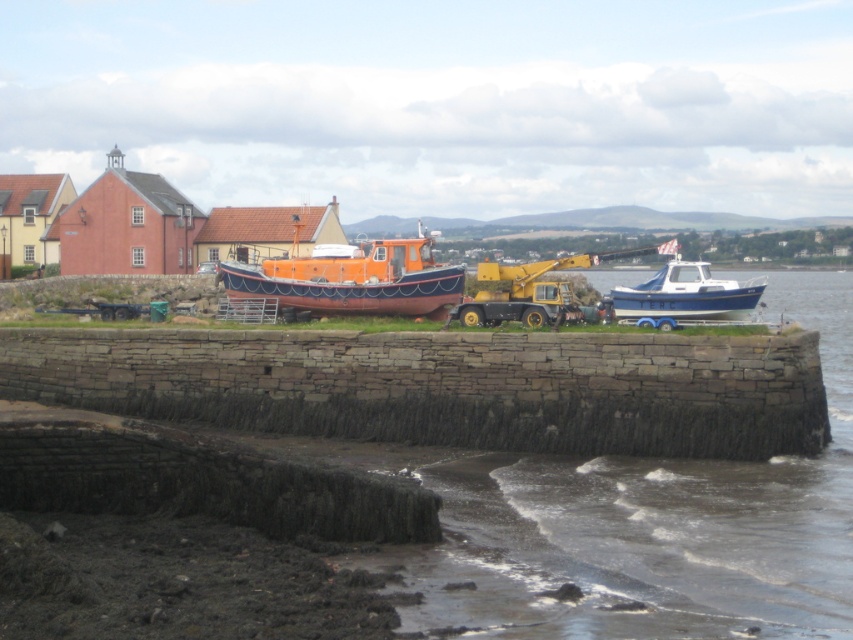
Question: Which point is closer to the camera?

Choices:
 (A) blue glossy boat at right
 (B) orange matte boat at center

Answer: (A)

Question: Which of the following is the closest to the observer?

Choices:
 (A) (689, 273)
 (B) (325, 282)

Answer: (A)

Question: Is orange matte boat at center further to camera compared to blue glossy boat at right?

Choices:
 (A) no
 (B) yes

Answer: (B)

Question: Among these objects, which one is nearest to the camera?

Choices:
 (A) orange matte boat at center
 (B) blue glossy boat at right

Answer: (B)

Question: Does orange matte boat at center have a greater width compared to blue glossy boat at right?

Choices:
 (A) yes
 (B) no

Answer: (A)

Question: Can you confirm if orange matte boat at center is thinner than blue glossy boat at right?

Choices:
 (A) no
 (B) yes

Answer: (A)